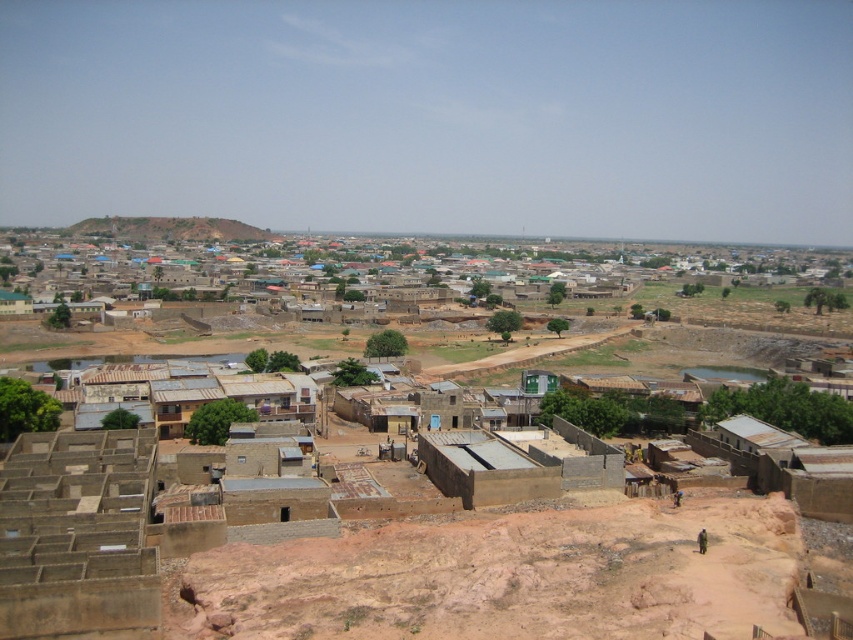
You are a drone operator tasked with capturing aerial footage of the urban area. You need to ensure that the brown concrete hut at center and the brown earthy hillside at upper left are both visible in the frame. Considering their heights, which object should you position closer to the camera to ensure both are fully visible?

The brown concrete hut at center is shorter than the brown earthy hillside at upper left. To ensure both are fully visible, position the brown concrete hut at center closer to the camera since it is shorter, allowing the taller hillside to still be in frame without being cut off.

You are a city planner analyzing this urban area. You need to determine which structure has a wider base for potential expansion projects. Based on the image, which one is narrower between the brown concrete hut at center and the brown earthy hillside at upper left?

The brown concrete hut at center is narrower than the brown earthy hillside at upper left, so the hillside has a wider base for expansion.

You are a city planner analyzing this urban area. You notice the brown sandy dirt field at lower center and the brown concrete hut at center. Which of these two features is located closer to the ground level?

The brown sandy dirt field at lower center is positioned under brown concrete hut at center, so it is closer to the ground level.